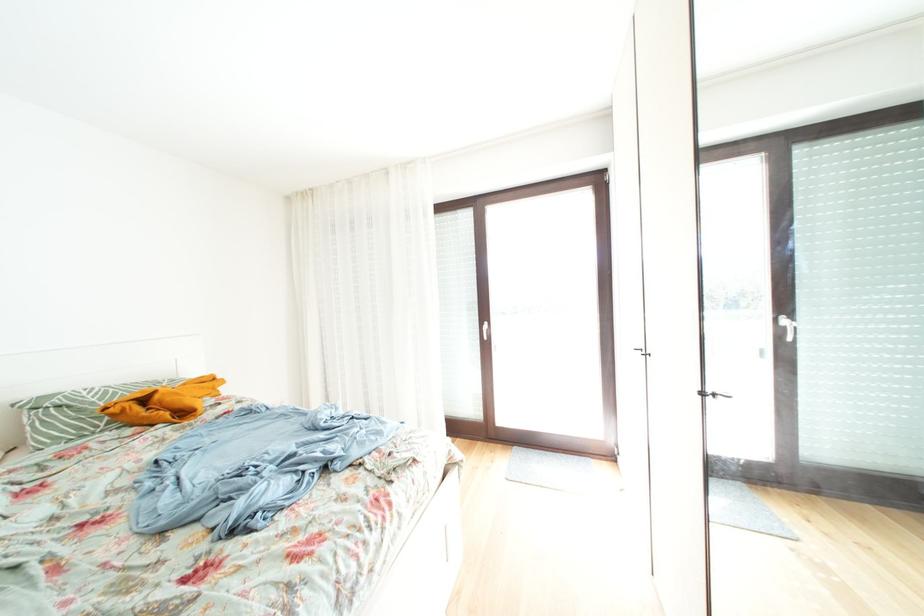
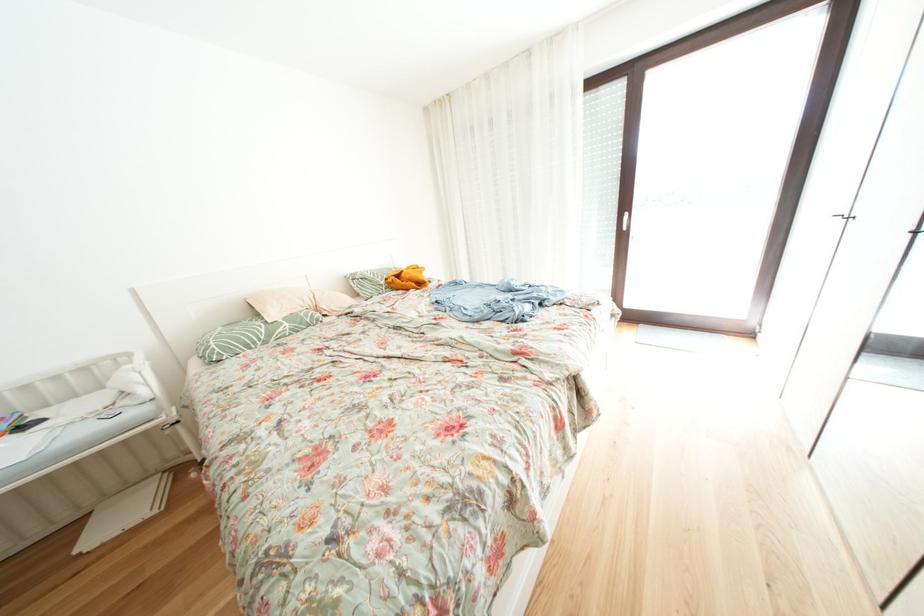
Locate, in the second image, the point that corresponds to [621,462] in the first image.

(759, 339)